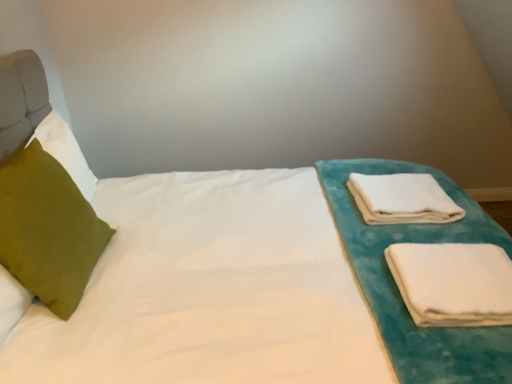
Locate an element on the screen. Image resolution: width=512 pixels, height=384 pixels. white soft towel at right, the second cloth from the front is located at coordinates (402, 199).

Image resolution: width=512 pixels, height=384 pixels. I want to click on white soft cloth at right, marked as the second cloth in a back-to-front arrangement, so click(x=453, y=283).

Image resolution: width=512 pixels, height=384 pixels. Find the location of `white soft towel at right, which is the 1th cloth from back to front`. white soft towel at right, which is the 1th cloth from back to front is located at coordinates (402, 199).

Is white soft towel at right, which ranks as the 1th cloth in top-to-bottom order, inside the boundaries of green velvet pillow at left, or outside?

white soft towel at right, which ranks as the 1th cloth in top-to-bottom order, is located beyond the bounds of green velvet pillow at left.

Is white soft towel at right, which is counted as the second cloth, starting from the bottom, oriented away from green velvet pillow at left?

Yes, white soft towel at right, which is counted as the second cloth, starting from the bottom, is facing away from green velvet pillow at left.

Based on the photo, from the image's perspective, which object appears higher, white soft towel at right, which is counted as the second cloth, starting from the bottom, or green velvet pillow at left?

From the image's view, white soft towel at right, which is counted as the second cloth, starting from the bottom, is above.

Who is more distant, white soft towel at right, which ranks as the 1th cloth in top-to-bottom order, or green velvet pillow at left?

white soft towel at right, which ranks as the 1th cloth in top-to-bottom order, is further away from the camera.

Is white soft cloth at right, which is the first cloth from bottom to top, turned away from white soft towel at right, which ranks as the 1th cloth in top-to-bottom order?

No, white soft cloth at right, which is the first cloth from bottom to top,'s orientation is not away from white soft towel at right, which ranks as the 1th cloth in top-to-bottom order.

Which is more to the right, white soft cloth at right, marked as the second cloth in a back-to-front arrangement, or white soft towel at right, which is the 1th cloth from back to front?

white soft cloth at right, marked as the second cloth in a back-to-front arrangement.

Which of these two, white soft cloth at right, which is the first cloth from bottom to top, or white soft towel at right, which is counted as the second cloth, starting from the bottom, is bigger?

Bigger between the two is white soft towel at right, which is counted as the second cloth, starting from the bottom.

How different are the orientations of white soft cloth at right, which is the first cloth from bottom to top, and white soft towel at right, the second cloth from the front, in degrees?

The angle between the facing direction of white soft cloth at right, which is the first cloth from bottom to top, and the facing direction of white soft towel at right, the second cloth from the front, is 1.61 degrees.

Considering the positions of objects green velvet pillow at left and white soft towel at right, which is counted as the second cloth, starting from the bottom, in the image provided, who is more to the right, green velvet pillow at left or white soft towel at right, which is counted as the second cloth, starting from the bottom,?

white soft towel at right, which is counted as the second cloth, starting from the bottom.

Which point is more distant from viewer, (32,218) or (413,217)?

The point (413,217) is more distant.

Which object is wider, green velvet pillow at left or white soft towel at right, which is counted as the second cloth, starting from the bottom?

white soft towel at right, which is counted as the second cloth, starting from the bottom.

Who is bigger, green velvet pillow at left or white soft towel at right, which is the 1th cloth from back to front?

With larger size is green velvet pillow at left.

How different are the orientations of white soft towel at right, which is the 1th cloth from back to front, and white soft cloth at right, the 2th cloth in the top-to-bottom sequence, in degrees?

They differ by 1.61 degrees in their facing directions.

From the picture: Can you confirm if white soft towel at right, the second cloth from the front, is positioned to the left of white soft cloth at right, the 2th cloth in the top-to-bottom sequence?

Yes, white soft towel at right, the second cloth from the front, is to the left of white soft cloth at right, the 2th cloth in the top-to-bottom sequence.

Looking at this image, is white soft towel at right, which ranks as the 1th cloth in top-to-bottom order, far from white soft cloth at right, which is the first cloth in front-to-back order?

They are positioned close to each other.

From the image's perspective, is white soft towel at right, which ranks as the 1th cloth in top-to-bottom order, located beneath white soft cloth at right, marked as the second cloth in a back-to-front arrangement?

No.

Is the depth of white soft cloth at right, the 2th cloth in the top-to-bottom sequence, greater than that of green velvet pillow at left?

That is True.

From a real-world perspective, is white soft cloth at right, the 2th cloth in the top-to-bottom sequence, physically below green velvet pillow at left?

Indeed, from a real-world perspective, white soft cloth at right, the 2th cloth in the top-to-bottom sequence, is positioned beneath green velvet pillow at left.

Is white soft cloth at right, marked as the second cloth in a back-to-front arrangement, far from green velvet pillow at left?

That's right, there is a large distance between white soft cloth at right, marked as the second cloth in a back-to-front arrangement, and green velvet pillow at left.

Which is nearer, (509, 311) or (81, 239)?

Point (509, 311) is positioned closer to the camera compared to point (81, 239).

Is the surface of green velvet pillow at left in direct contact with white soft cloth at right, the 2th cloth in the top-to-bottom sequence?

No, green velvet pillow at left is not making contact with white soft cloth at right, the 2th cloth in the top-to-bottom sequence.

Is green velvet pillow at left shorter than white soft cloth at right, which is the first cloth from bottom to top?

In fact, green velvet pillow at left may be taller than white soft cloth at right, which is the first cloth from bottom to top.

Considering the relative positions of green velvet pillow at left and white soft cloth at right, which is the first cloth from bottom to top, in the image provided, is green velvet pillow at left to the left or to the right of white soft cloth at right, which is the first cloth from bottom to top,?

green velvet pillow at left is to the left of white soft cloth at right, which is the first cloth from bottom to top.

Is point (10, 264) positioned behind point (414, 265)?

That is False.

Locate an element on the screen. The image size is (512, 384). pillow below the white soft towel at right, which ranks as the 1th cloth in top-to-bottom order (from the image's perspective) is located at coordinates (48, 230).

Identify the location of cloth that appears above the white soft cloth at right, the 2th cloth in the top-to-bottom sequence (from a real-world perspective). (402, 199).

Looking at the image, which one is located further to white soft towel at right, which is counted as the second cloth, starting from the bottom, white soft cloth at right, which is the first cloth in front-to-back order, or green velvet pillow at left?

green velvet pillow at left lies further to white soft towel at right, which is counted as the second cloth, starting from the bottom, than the other object.

Looking at the image, which one is located further to white soft cloth at right, the 2th cloth in the top-to-bottom sequence, green velvet pillow at left or white soft towel at right, which is the 1th cloth from back to front?

Based on the image, green velvet pillow at left appears to be further to white soft cloth at right, the 2th cloth in the top-to-bottom sequence.

Looking at the image, which one is located closer to green velvet pillow at left, white soft towel at right, which ranks as the 1th cloth in top-to-bottom order, or white soft cloth at right, which is the first cloth in front-to-back order?

white soft cloth at right, which is the first cloth in front-to-back order, is closer to green velvet pillow at left.

Estimate the real-world distances between objects in this image. Which object is further from green velvet pillow at left, white soft cloth at right, which is the first cloth from bottom to top, or white soft towel at right, which is counted as the second cloth, starting from the bottom?

white soft towel at right, which is counted as the second cloth, starting from the bottom.

Looking at the image, which one is located closer to white soft towel at right, the second cloth from the front, green velvet pillow at left or white soft cloth at right, which is the first cloth in front-to-back order?

Among the two, white soft cloth at right, which is the first cloth in front-to-back order, is located nearer to white soft towel at right, the second cloth from the front.

From the image, which object appears to be nearer to white soft cloth at right, the 2th cloth in the top-to-bottom sequence, white soft towel at right, which is counted as the second cloth, starting from the bottom, or green velvet pillow at left?

white soft towel at right, which is counted as the second cloth, starting from the bottom.

This screenshot has height=384, width=512. Find the location of `cloth located between green velvet pillow at left and white soft cloth at right, which is the first cloth in front-to-back order, in the left-right direction`. cloth located between green velvet pillow at left and white soft cloth at right, which is the first cloth in front-to-back order, in the left-right direction is located at coordinates (402, 199).